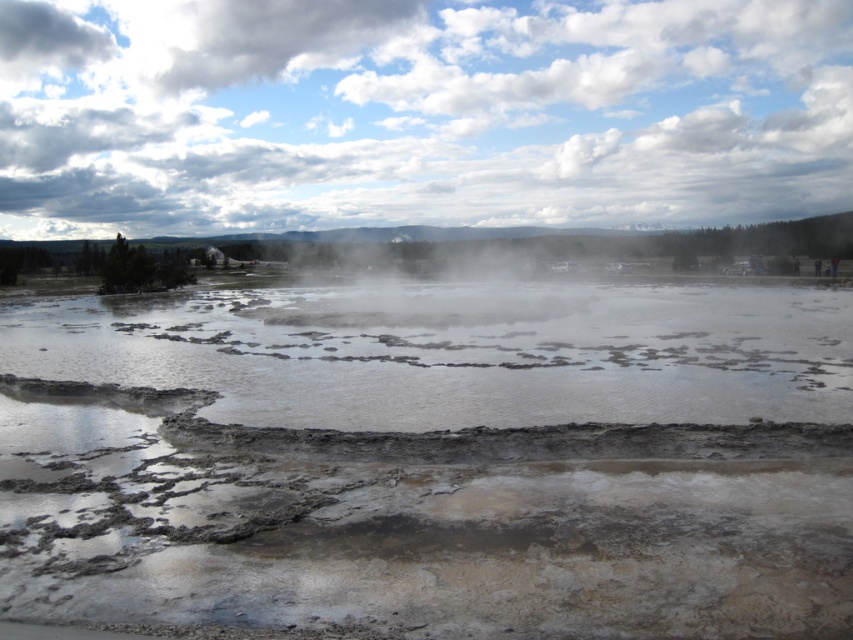
Question: Estimate the real-world distances between objects in this image. Which object is closer to the muddy water at center?

Choices:
 (A) cloudy sky at upper center
 (B) white misty steam at center

Answer: (B)

Question: Does cloudy sky at upper center appear over white misty steam at center?

Choices:
 (A) no
 (B) yes

Answer: (B)

Question: Can you confirm if cloudy sky at upper center is positioned below white misty steam at center?

Choices:
 (A) yes
 (B) no

Answer: (B)

Question: Which object is farther from the camera taking this photo?

Choices:
 (A) muddy water at center
 (B) cloudy sky at upper center
 (C) white misty steam at center

Answer: (B)

Question: Is muddy water at center to the right of cloudy sky at upper center from the viewer's perspective?

Choices:
 (A) yes
 (B) no

Answer: (B)

Question: Which object is positioned farthest from the cloudy sky at upper center?

Choices:
 (A) muddy water at center
 (B) white misty steam at center

Answer: (A)